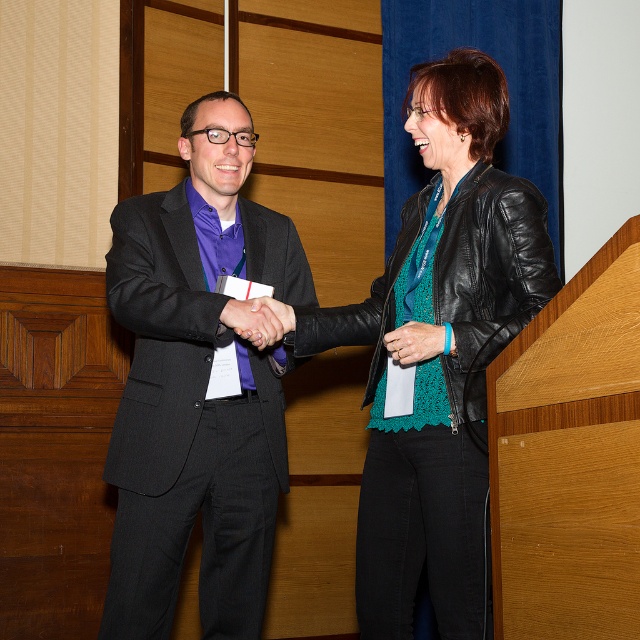
You are an event organizer setting up a photo backdrop. You need to ensure the backdrop is wide enough to frame both the matte black suit at center and the matte black leather at center properly. Based on their positions and sizes, can you determine if the backdrop needs to be wider than the combined width of both objects?

The matte black suit at center might be wider than matte black leather at center, but without exact measurements, it is uncertain. The backdrop should be designed to accommodate the widest possible width between the two to ensure proper framing.

In the scene shown: You are standing at the origin point in the image. Which of the two points, point (x=180, y=529) or point (x=451, y=342), is closer to you?

Point (x=451, y=342) is closer to you because it is in front of point (x=180, y=529).

You are attending an event and need to find the person wearing the black leather jacket at center. Where should you look relative to the matte black leather at center?

The black leather jacket at center is located to the right of the matte black leather at center, so you should look to the right side of the matte black leather at center to find the person wearing the black leather jacket at center.